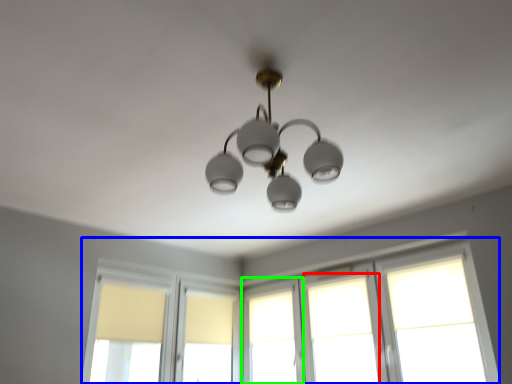
Question: Which is nearer to the window (highlighted by a red box)? window (highlighted by a blue box) or window (highlighted by a green box).

Choices:
 (A) window
 (B) window

Answer: (A)